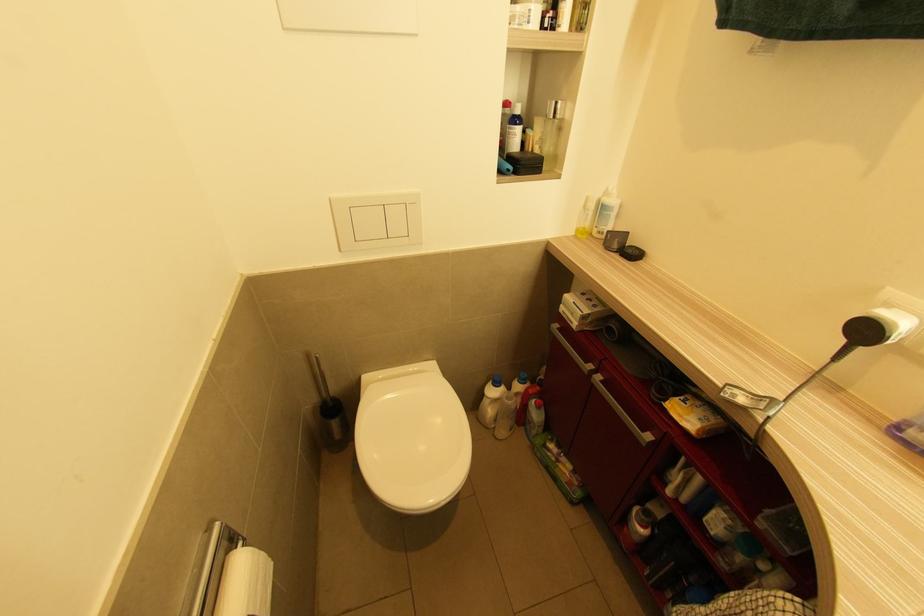
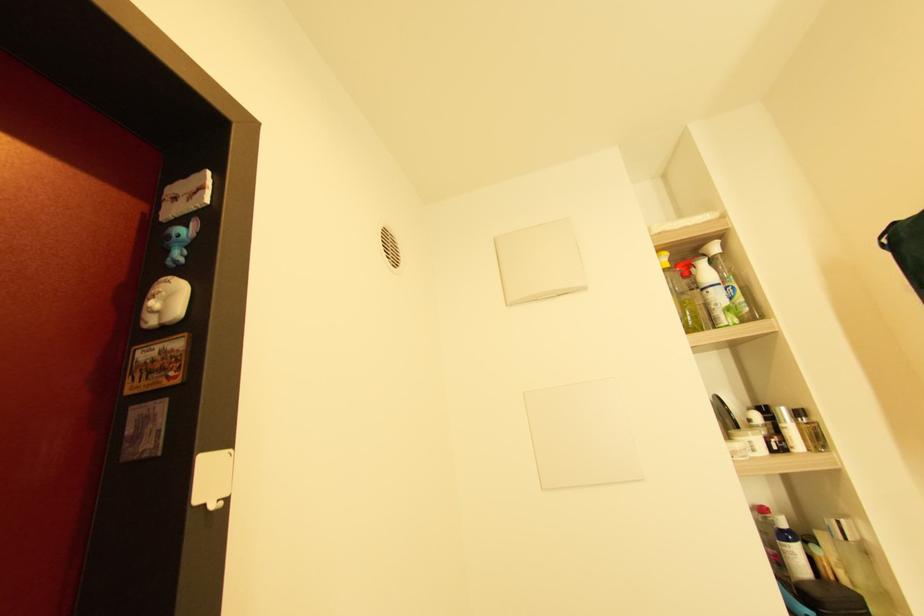
How did the camera likely rotate?

The camera rotated toward left-up.